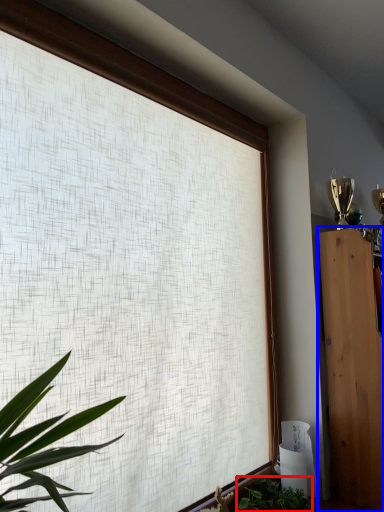
Question: Which of the following is the closest to the observer, houseplant (highlighted by a red box) or furniture (highlighted by a blue box)?

Choices:
 (A) houseplant
 (B) furniture

Answer: (B)